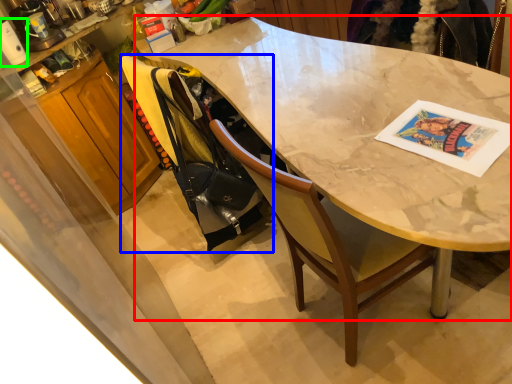
Question: Which object is the closest to the desk (highlighted by a red box)? Choose among these: handbag (highlighted by a blue box) or appliance (highlighted by a green box).

Choices:
 (A) handbag
 (B) appliance

Answer: (A)